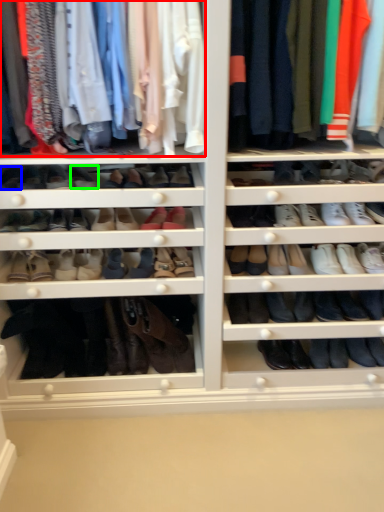
Question: Based on their relative distances, which object is farther from clothing (highlighted by a red box)? Choose from shoe (highlighted by a blue box) and shoe (highlighted by a green box).

Choices:
 (A) shoe
 (B) shoe

Answer: (A)